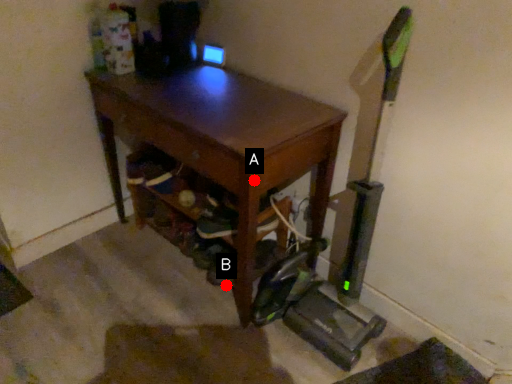
Question: Two points are circled on the image, labeled by A and B beside each circle. Which point is closer to the camera?

Choices:
 (A) A is closer
 (B) B is closer

Answer: (A)